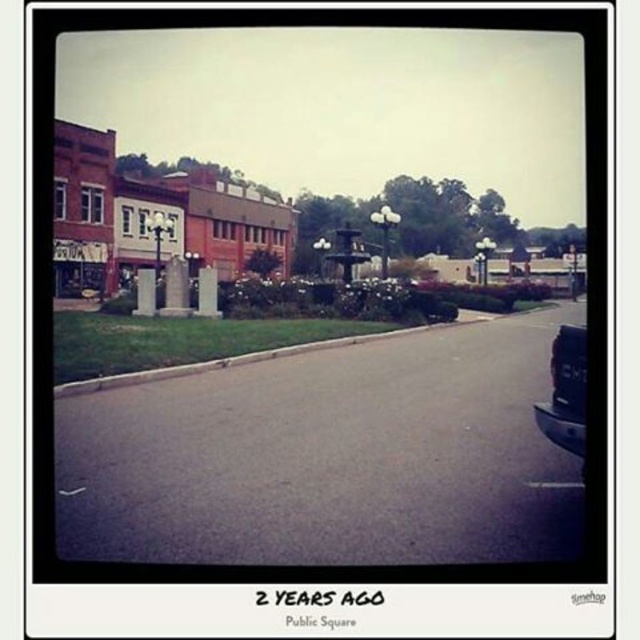
Does brick building at left have a lesser width compared to black matte truck at right?

Incorrect, brick building at left's width is not less than black matte truck at right's.

Is brick building at left positioned behind black matte truck at right?

Yes.

Who is more forward, (x=237, y=189) or (x=582, y=403)?

Point (x=582, y=403)

This screenshot has height=640, width=640. Identify the location of brick building at left. (148, 216).

Does black matte truck at right have a lesser height compared to gray concrete curb at lower center?

No.

Locate an element on the screen. The width and height of the screenshot is (640, 640). black matte truck at right is located at coordinates (564, 392).

The height and width of the screenshot is (640, 640). I want to click on black matte truck at right, so click(564, 392).

Between brick building at left and gray concrete curb at lower center, which one has less height?

gray concrete curb at lower center

Who is more forward, [128,232] or [420,330]?

Point [420,330] is in front.

This screenshot has width=640, height=640. In order to click on brick building at left in this screenshot , I will do `click(148, 216)`.